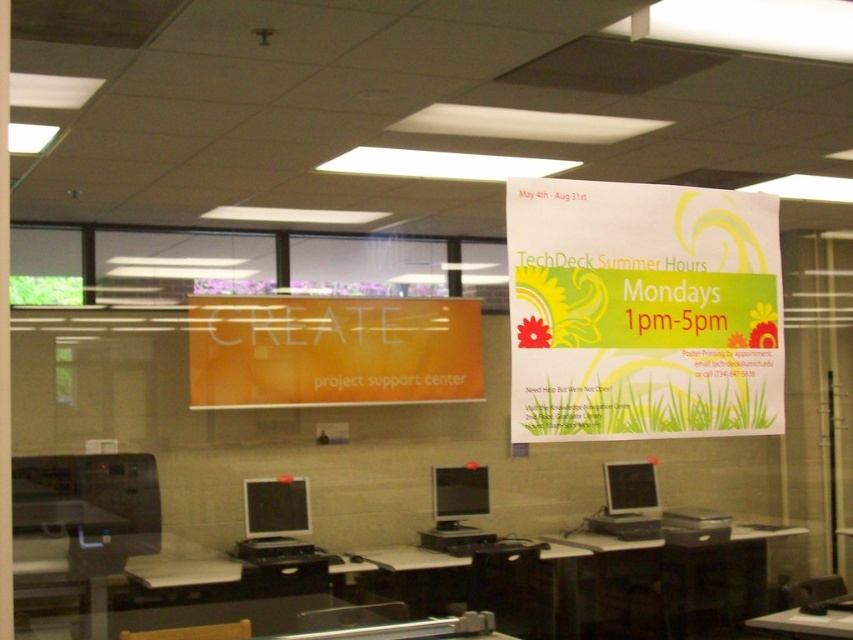
Does matte black monitor at lower left have a greater height compared to wooden desk at center?

Correct, matte black monitor at lower left is much taller as wooden desk at center.

Does matte black monitor at lower left appear over wooden desk at center?

No, matte black monitor at lower left is not above wooden desk at center.

Between point (252, 483) and point (811, 618), which one is positioned in front?

Positioned in front is point (811, 618).

I want to click on matte black monitor at lower left, so click(274, 516).

Who is shorter, orange glossy sign at center or matte black monitor at center?

With less height is matte black monitor at center.

Who is lower down, orange glossy sign at center or matte black monitor at center?

Positioned lower is matte black monitor at center.

What do you see at coordinates (331, 349) in the screenshot? This screenshot has height=640, width=853. I see `orange glossy sign at center` at bounding box center [331, 349].

This screenshot has width=853, height=640. In order to click on orange glossy sign at center in this screenshot , I will do `click(331, 349)`.

Who is more forward, (277, 534) or (469, 476)?

Positioned in front is point (277, 534).

Which is behind, point (260, 500) or point (440, 524)?

The point (440, 524) is behind.

I want to click on matte black monitor at lower left, so (274, 516).